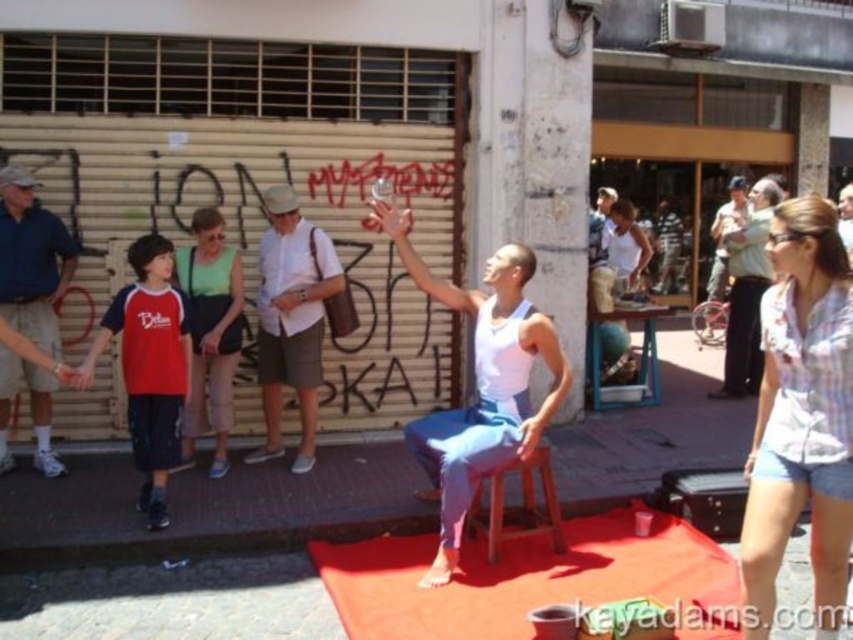
Question: Is blue denim shorts at left closer to the viewer compared to green fabric dress at center?

Choices:
 (A) no
 (B) yes

Answer: (B)

Question: Which of the following is the farthest from the observer?

Choices:
 (A) (48, 323)
 (B) (500, 500)
 (C) (263, 310)
 (D) (329, 564)

Answer: (C)

Question: Is red cotton shirt at left thinner than wooden stool at center?

Choices:
 (A) no
 (B) yes

Answer: (B)

Question: Can you confirm if plaid shirt at center is positioned above red cotton shirt at left?

Choices:
 (A) yes
 (B) no

Answer: (B)

Question: Which object is the closest to the white cotton shirt at center?

Choices:
 (A) blue denim shorts at left
 (B) wooden stool at center
 (C) rubberized red mat at center

Answer: (A)

Question: Which of the following is the closest to the observer?

Choices:
 (A) (4, 369)
 (B) (128, 403)
 (C) (541, 445)
 (D) (730, 605)

Answer: (D)